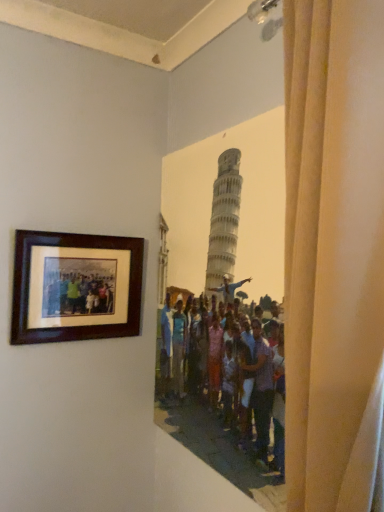
Question: Is brown wooden picture frame at upper left taller or shorter than beige fabric curtain at right?

Choices:
 (A) short
 (B) tall

Answer: (A)

Question: Considering the positions of point (23, 323) and point (360, 356), is point (23, 323) closer or farther from the camera than point (360, 356)?

Choices:
 (A) closer
 (B) farther

Answer: (B)

Question: Considering the positions of brown wooden picture frame at upper left and beige fabric curtain at right in the image, is brown wooden picture frame at upper left wider or thinner than beige fabric curtain at right?

Choices:
 (A) thin
 (B) wide

Answer: (A)

Question: In terms of width, does beige fabric curtain at right look wider or thinner when compared to brown wooden picture frame at upper left?

Choices:
 (A) thin
 (B) wide

Answer: (B)

Question: Considering the positions of point (296, 373) and point (71, 312), is point (296, 373) closer or farther from the camera than point (71, 312)?

Choices:
 (A) farther
 (B) closer

Answer: (B)

Question: Considering the positions of beige fabric curtain at right and brown wooden picture frame at upper left in the image, is beige fabric curtain at right taller or shorter than brown wooden picture frame at upper left?

Choices:
 (A) tall
 (B) short

Answer: (A)

Question: Considering their positions, is beige fabric curtain at right located in front of or behind brown wooden picture frame at upper left?

Choices:
 (A) behind
 (B) front

Answer: (B)